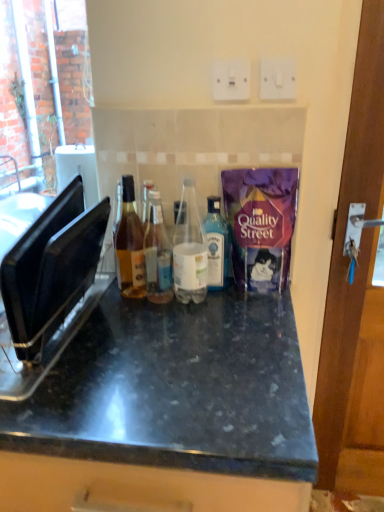
Question: Does black plastic toaster at left have a smaller size compared to white plastic electric outlet at upper center, the 1th electric outlet positioned from the left?

Choices:
 (A) no
 (B) yes

Answer: (A)

Question: Is black plastic toaster at left positioned with its back to white plastic electric outlet at upper center, acting as the 2th electric outlet starting from the right?

Choices:
 (A) no
 (B) yes

Answer: (A)

Question: Is black plastic toaster at left not within white plastic electric outlet at upper center, the 1th electric outlet positioned from the left?

Choices:
 (A) yes
 (B) no

Answer: (A)

Question: Does black plastic toaster at left appear on the left side of white plastic electric outlet at upper center, acting as the 2th electric outlet starting from the right?

Choices:
 (A) no
 (B) yes

Answer: (B)

Question: Is black plastic toaster at left oriented towards white plastic electric outlet at upper center, acting as the 2th electric outlet starting from the right?

Choices:
 (A) yes
 (B) no

Answer: (B)

Question: From the image's perspective, is translucent glass bottle at center, the second bottle in the left-to-right sequence, above or below black plastic toaster at left?

Choices:
 (A) above
 (B) below

Answer: (A)

Question: From their relative heights in the image, would you say translucent glass bottle at center, the second bottle in the left-to-right sequence, is taller or shorter than black plastic toaster at left?

Choices:
 (A) tall
 (B) short

Answer: (B)

Question: Is translucent glass bottle at center, which is counted as the 3th bottle, starting from the right, wider or thinner than black plastic toaster at left?

Choices:
 (A) thin
 (B) wide

Answer: (A)

Question: From a real-world perspective, is translucent glass bottle at center, the second bottle in the left-to-right sequence, positioned above or below black plastic toaster at left?

Choices:
 (A) above
 (B) below

Answer: (B)

Question: Considering the positions of black granite countertop at center and blue glass bottle at center, which ranks as the 4th bottle in left-to-right order, in the image, is black granite countertop at center bigger or smaller than blue glass bottle at center, which ranks as the 4th bottle in left-to-right order,?

Choices:
 (A) big
 (B) small

Answer: (A)

Question: Does point (266, 399) appear closer or farther from the camera than point (220, 206)?

Choices:
 (A) closer
 (B) farther

Answer: (A)

Question: From their relative heights in the image, would you say black granite countertop at center is taller or shorter than blue glass bottle at center, which ranks as the 4th bottle in left-to-right order?

Choices:
 (A) short
 (B) tall

Answer: (B)

Question: Considering their positions, is black granite countertop at center located in front of or behind blue glass bottle at center, the first bottle viewed from the right?

Choices:
 (A) front
 (B) behind

Answer: (A)

Question: Is blue glass bottle at center, the first bottle viewed from the right, wider or thinner than translucent glass bottle at center, which is counted as the 3th bottle, starting from the right?

Choices:
 (A) wide
 (B) thin

Answer: (B)

Question: Is blue glass bottle at center, which ranks as the 4th bottle in left-to-right order, taller or shorter than translucent glass bottle at center, which is counted as the 3th bottle, starting from the right?

Choices:
 (A) short
 (B) tall

Answer: (A)